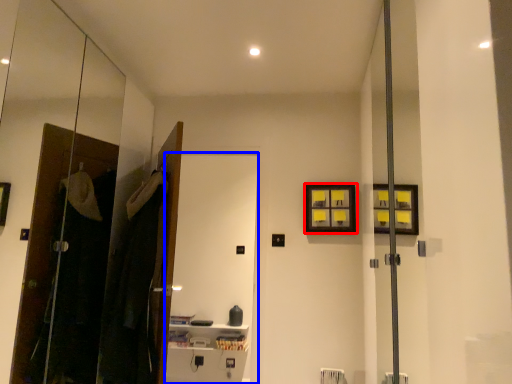
Question: Among these objects, which one is nearest to the camera, picture frame (highlighted by a red box) or screen door (highlighted by a blue box)?

Choices:
 (A) picture frame
 (B) screen door

Answer: (B)